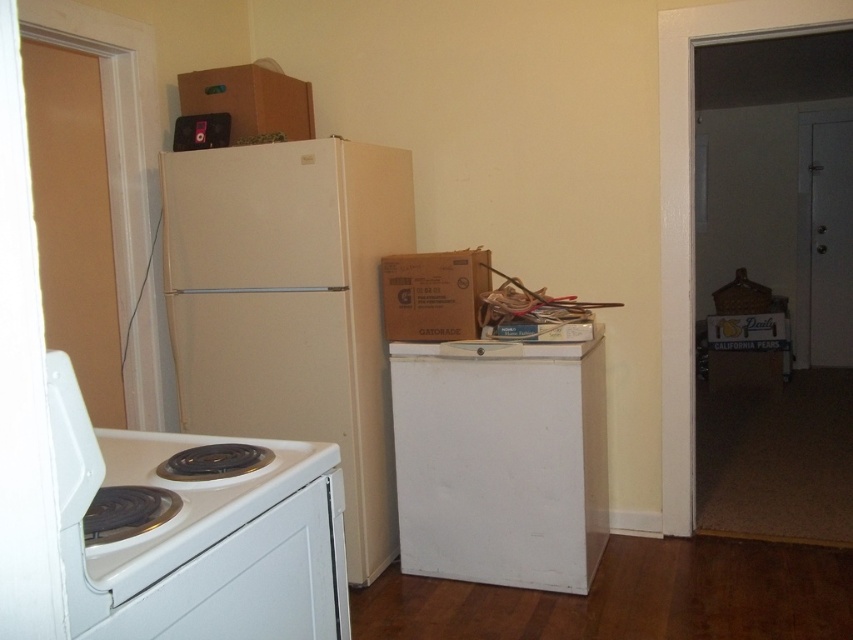
Question: Is cardboard box at center wider than cardboard box at upper center?

Choices:
 (A) yes
 (B) no

Answer: (B)

Question: Which point is closer to the camera taking this photo?

Choices:
 (A) (410, 304)
 (B) (410, 228)
 (C) (553, 435)

Answer: (C)

Question: Is white matte refrigerator at center closer to camera compared to white matte mini fridge at center?

Choices:
 (A) no
 (B) yes

Answer: (B)

Question: Which is farther from the white matte mini fridge at center?

Choices:
 (A) cardboard box at upper center
 (B) cardboard box at center
 (C) white matte refrigerator at center

Answer: (A)

Question: Does white matte refrigerator at center have a lesser width compared to cardboard box at center?

Choices:
 (A) no
 (B) yes

Answer: (A)

Question: Which of the following is the farthest from the observer?

Choices:
 (A) (479, 301)
 (B) (305, 115)

Answer: (B)